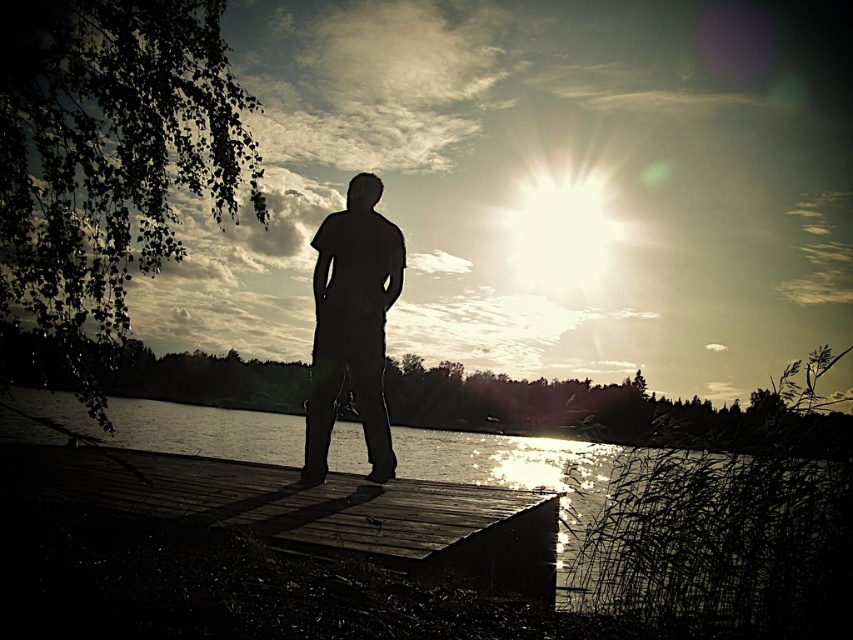
Who is shorter, dark wood dock at center or silvery water at dock center?

With less height is dark wood dock at center.

Where is `dark wood dock at center`? dark wood dock at center is located at coordinates (310, 509).

Between point (430, 429) and point (338, 244), which one is positioned in front?

Point (338, 244)

Is point (15, 396) more distant than point (334, 212)?

Yes, point (15, 396) is behind point (334, 212).

Is point (572, 529) less distant than point (374, 285)?

No, (572, 529) is behind (374, 285).

The image size is (853, 640). Identify the location of silvery water at dock center. (515, 468).

Which is more to the right, dark wood dock at center or silhouette figure at center?

silhouette figure at center is more to the right.

Which is below, dark wood dock at center or silhouette figure at center?

dark wood dock at center is below.

This screenshot has height=640, width=853. I want to click on dark wood dock at center, so [x=310, y=509].